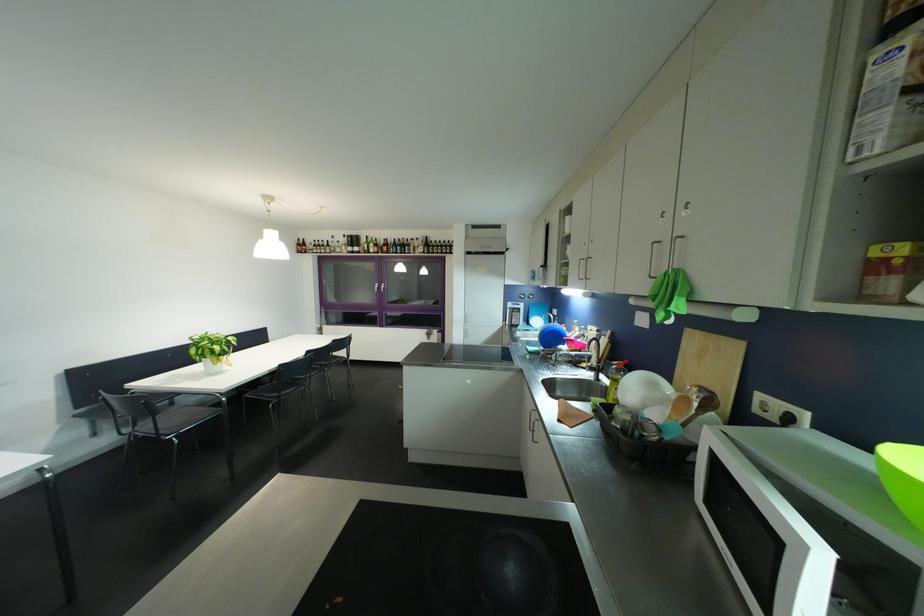
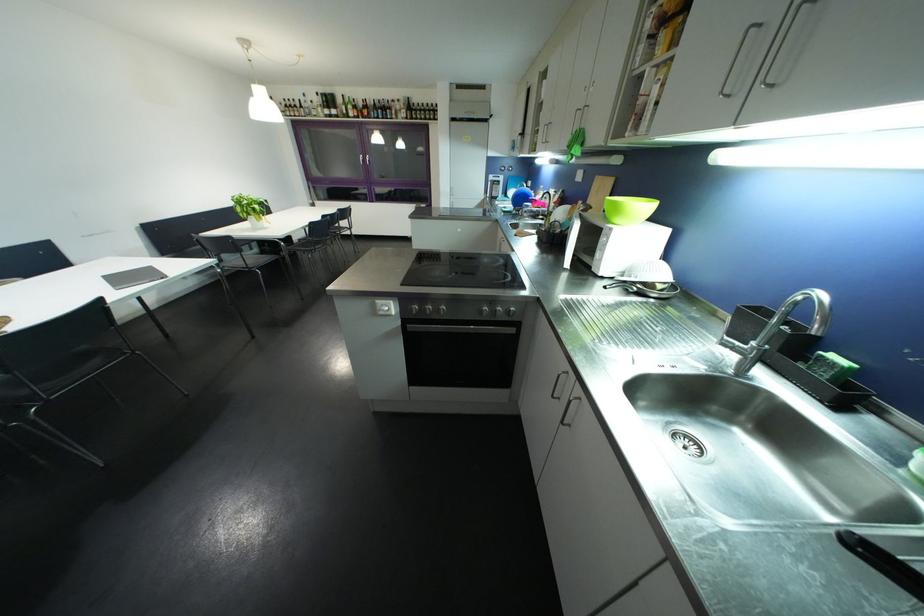
Locate, in the second image, the point that corresponds to [347,246] in the first image.

(322, 107)